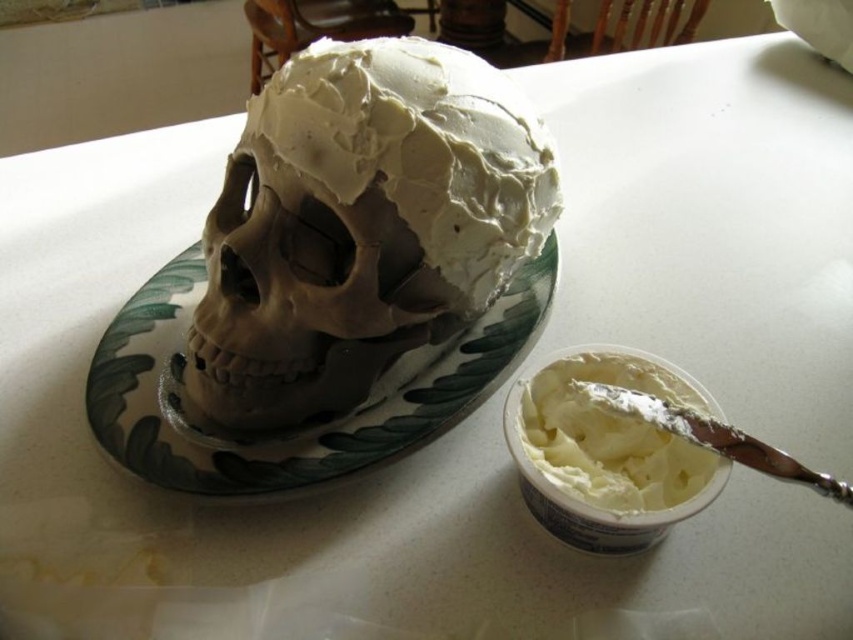
Question: Is matte clay skull at center to the left of green leafy platter at center from the viewer's perspective?

Choices:
 (A) no
 (B) yes

Answer: (A)

Question: Which point is farther from the camera taking this photo?

Choices:
 (A) (360, 51)
 (B) (662, 508)

Answer: (A)

Question: Which point appears closest to the camera in this image?

Choices:
 (A) (614, 467)
 (B) (283, 346)
 (C) (160, 301)

Answer: (B)

Question: Can you confirm if matte clay skull at center is positioned to the right of white creamy frosting at lower right?

Choices:
 (A) no
 (B) yes

Answer: (A)

Question: Which point is closer to the camera?

Choices:
 (A) green leafy platter at center
 (B) white creamy frosting at lower right

Answer: (B)

Question: Can you confirm if matte clay skull at center is thinner than white creamy frosting at lower right?

Choices:
 (A) no
 (B) yes

Answer: (A)